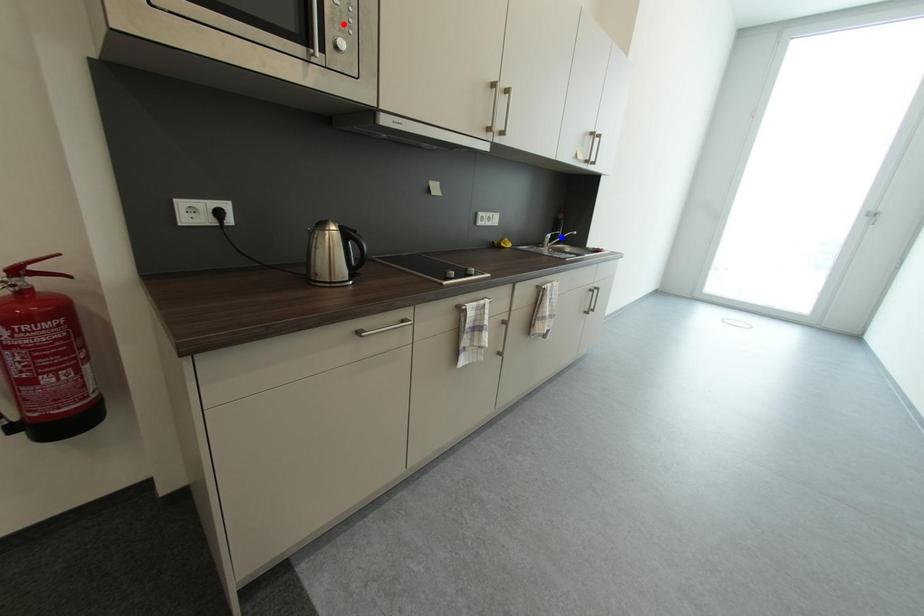
Question: Which of the two points in the image is closer to the camera?

Choices:
 (A) Blue point is closer.
 (B) Red point is closer.

Answer: (B)